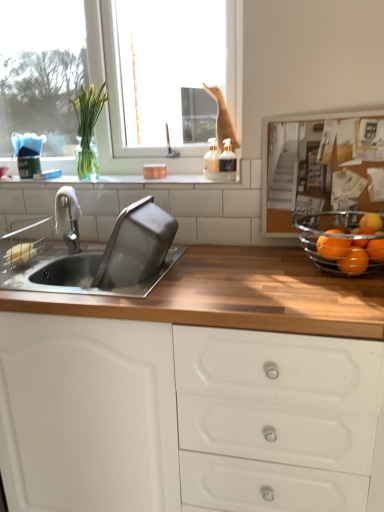
Locate an element on the screen. vacant space behind wooden cutting board at left is located at coordinates (54, 249).